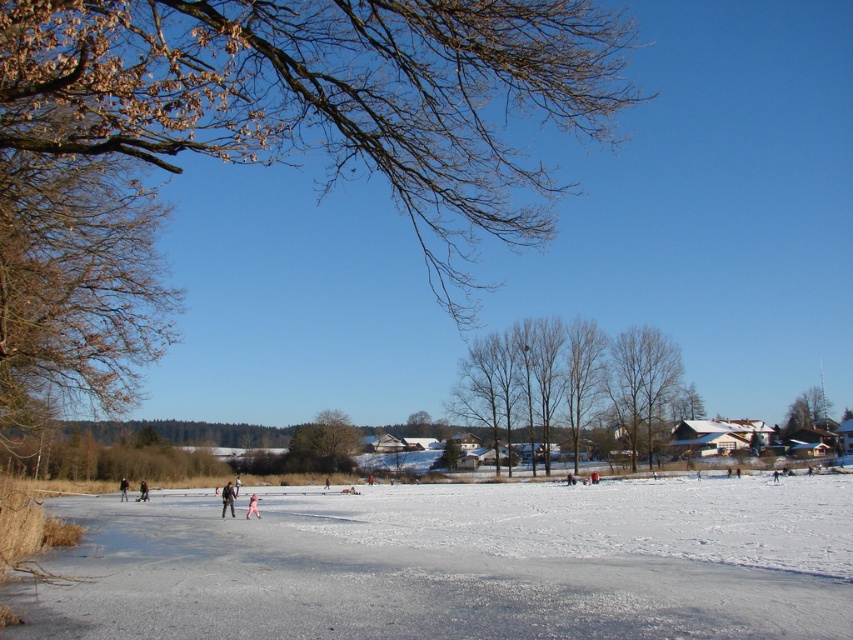
You are an artist planning to paint the winter scene. You want to highlight the contrast between the smooth bark trees at center and the brown textured tree at center. Which tree should you emphasize in terms of width to show their difference?

The smooth bark trees at center are wider than the brown textured tree at center, so emphasize the width of the smooth bark trees at center to highlight their contrast.

You are standing at the origin point of the coordinate system in this winter scene. The smooth bark trees at center are located at a specific coordinate. Can you determine their exact position?

The smooth bark trees at center are exactly at point (569, 380).